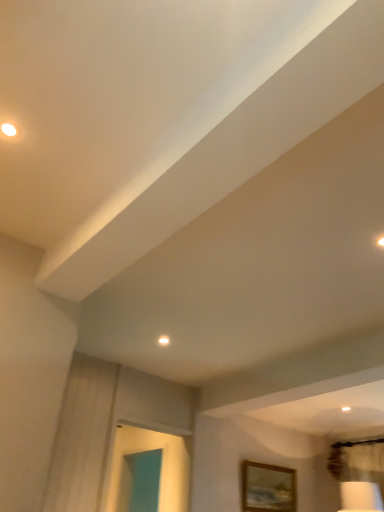
Question: Is white glossy droplight at upper center positioned behind wooden picture frame at lower right?

Choices:
 (A) no
 (B) yes

Answer: (A)

Question: Is white glossy droplight at upper center to the right of wooden picture frame at lower right from the viewer's perspective?

Choices:
 (A) yes
 (B) no

Answer: (B)

Question: Is white glossy droplight at upper center positioned beyond the bounds of wooden picture frame at lower right?

Choices:
 (A) yes
 (B) no

Answer: (A)

Question: Are white glossy droplight at upper center and wooden picture frame at lower right far apart?

Choices:
 (A) yes
 (B) no

Answer: (A)

Question: Can you confirm if white glossy droplight at upper center is smaller than wooden picture frame at lower right?

Choices:
 (A) yes
 (B) no

Answer: (A)

Question: Does white glossy droplight at upper center have a lesser height compared to wooden picture frame at lower right?

Choices:
 (A) no
 (B) yes

Answer: (B)

Question: Is wooden picture frame at lower right to the left of white glossy droplight at upper center from the viewer's perspective?

Choices:
 (A) yes
 (B) no

Answer: (B)

Question: From the image's perspective, is wooden picture frame at lower right on white glossy droplight at upper center?

Choices:
 (A) no
 (B) yes

Answer: (A)

Question: Is wooden picture frame at lower right in contact with white glossy droplight at upper center?

Choices:
 (A) no
 (B) yes

Answer: (A)

Question: Is the position of wooden picture frame at lower right more distant than that of white glossy droplight at upper center?

Choices:
 (A) no
 (B) yes

Answer: (B)

Question: Is wooden picture frame at lower right turned away from white glossy droplight at upper center?

Choices:
 (A) yes
 (B) no

Answer: (B)

Question: Are wooden picture frame at lower right and white glossy droplight at upper center located far from each other?

Choices:
 (A) no
 (B) yes

Answer: (B)

Question: Is wooden picture frame at lower right spatially inside white glossy droplight at upper center, or outside of it?

Choices:
 (A) inside
 (B) outside

Answer: (B)